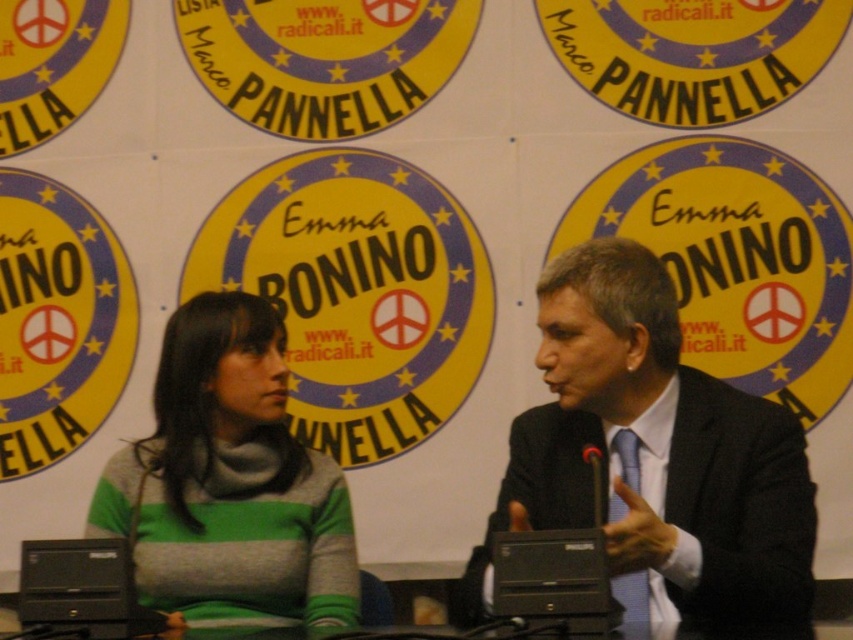
Which is above, dark suit at center or green knitted sweater at center?

dark suit at center is above.

Is dark suit at center wider than green knitted sweater at center?

Indeed, dark suit at center has a greater width compared to green knitted sweater at center.

Between point (682, 369) and point (201, 396), which one is positioned behind?

The point (201, 396) is behind.

Find the location of `dark suit at center`. dark suit at center is located at coordinates (656, 458).